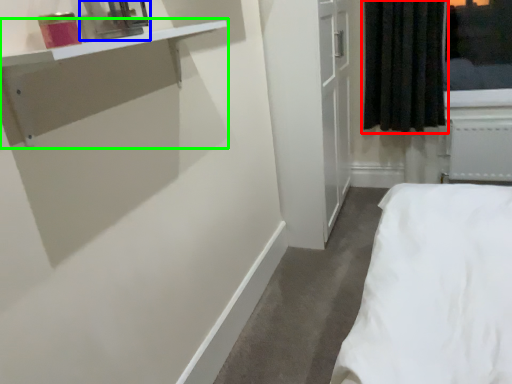
Question: Based on their relative distances, which object is nearer to curtain (highlighted by a red box)? Choose from medicine cabinet (highlighted by a blue box) and vanity (highlighted by a green box).

Choices:
 (A) medicine cabinet
 (B) vanity

Answer: (B)